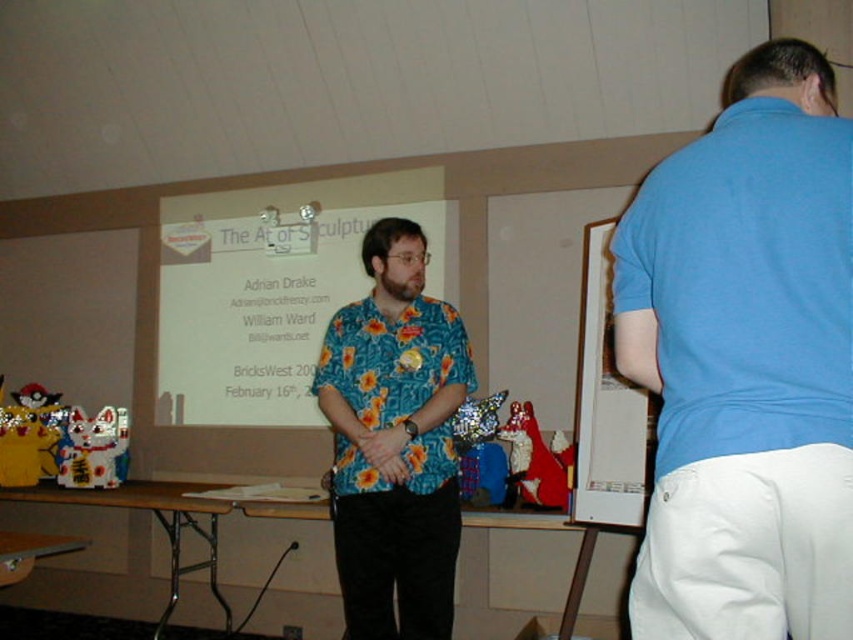
Question: Can you confirm if floral fabric shirt at center is bigger than white paper at upper center?

Choices:
 (A) no
 (B) yes

Answer: (B)

Question: Which point is farther to the camera?

Choices:
 (A) white paper at upper center
 (B) blue cotton shirt at upper right
 (C) floral fabric shirt at center

Answer: (A)

Question: Among these objects, which one is nearest to the camera?

Choices:
 (A) floral fabric shirt at center
 (B) blue cotton shirt at upper right

Answer: (B)

Question: Does blue cotton shirt at upper right have a lesser width compared to white paper at upper center?

Choices:
 (A) no
 (B) yes

Answer: (A)

Question: In this image, where is blue cotton shirt at upper right located relative to floral fabric shirt at center?

Choices:
 (A) right
 (B) left

Answer: (A)

Question: Estimate the real-world distances between objects in this image. Which object is farther from the blue cotton shirt at upper right?

Choices:
 (A) white paper at upper center
 (B) floral fabric shirt at center

Answer: (A)